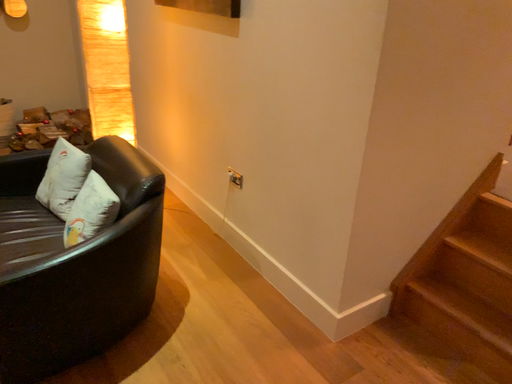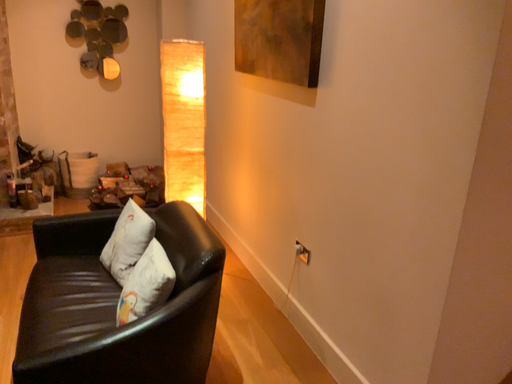
Question: Which way did the camera rotate in the video?

Choices:
 (A) rotated upward
 (B) rotated downward

Answer: (A)